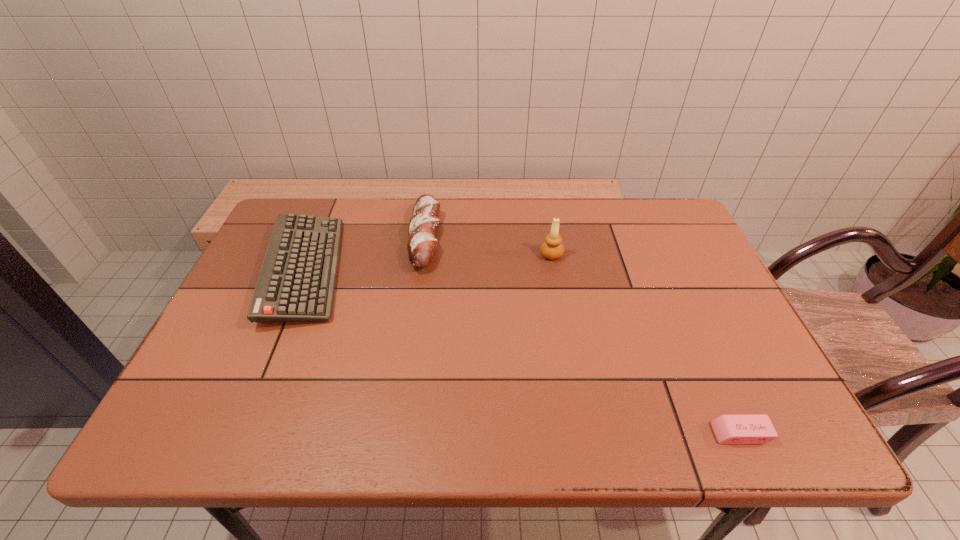
Where is `free space located 0.310m on the left of the shortest object`? The image size is (960, 540). free space located 0.310m on the left of the shortest object is located at coordinates (556, 434).

Locate an element on the screen. The width and height of the screenshot is (960, 540). baguet present at the far edge is located at coordinates (423, 225).

Locate an element on the screen. The image size is (960, 540). computer keyboard that is at the far edge is located at coordinates (297, 280).

Where is `object that is at the near edge`? The image size is (960, 540). object that is at the near edge is located at coordinates (729, 429).

Locate an element on the screen. object present at the left edge is located at coordinates (297, 280).

The image size is (960, 540). In order to click on object that is at the right edge in this screenshot , I will do `click(729, 429)`.

Identify the location of object that is at the far left corner. tap(297, 280).

Identify the location of object located at the near right corner. (729, 429).

Where is `vacant region at the far edge`? The width and height of the screenshot is (960, 540). vacant region at the far edge is located at coordinates (579, 236).

Identify the location of vacant area at the near edge of the desktop. (465, 429).